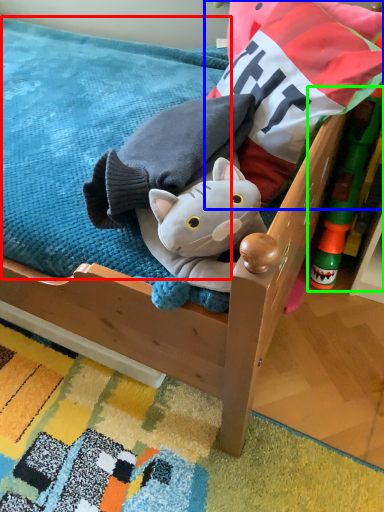
Question: Which object is positioned closest to mattress (highlighted by a red box)? Select from pillow (highlighted by a blue box) and toy (highlighted by a green box).

Choices:
 (A) pillow
 (B) toy

Answer: (A)